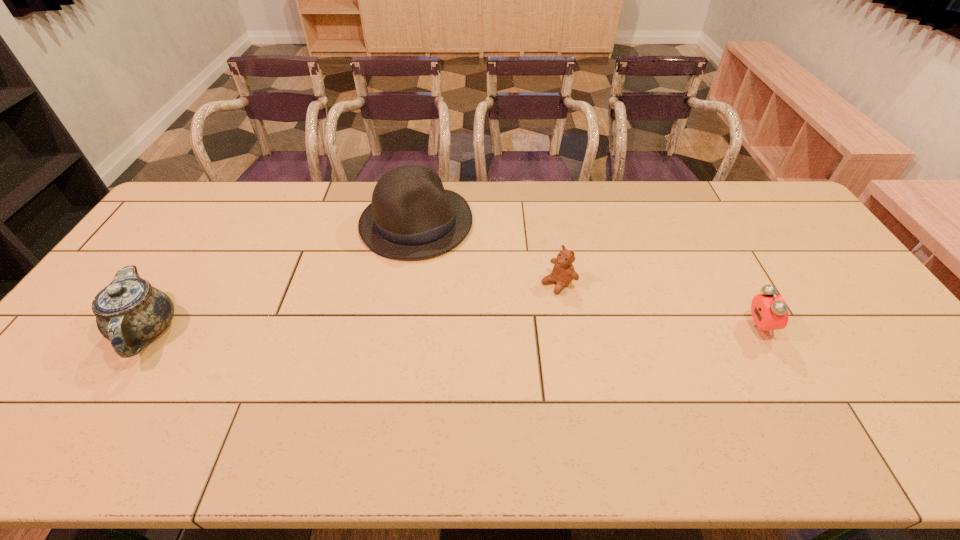
At what (x,y) coordinates should I click in order to perform the action: click on vacant space on the desktop that is between the chinaware and the rightmost object and is positioned on the front-facing side of the bowler hat. Please return your answer as a coordinate pair (x, y). Looking at the image, I should click on (513, 328).

You are a GUI agent. You are given a task and a screenshot of the screen. Output one action in this format:
    pyautogui.click(x=<x>, y=<y>)
    Task: Click on the vacant spot on the desktop that is between the chinaware and the alarm clock and is positioned on the face of the third object from left to right
    Image resolution: width=960 pixels, height=540 pixels.
    Given the screenshot: What is the action you would take?
    pyautogui.click(x=492, y=328)